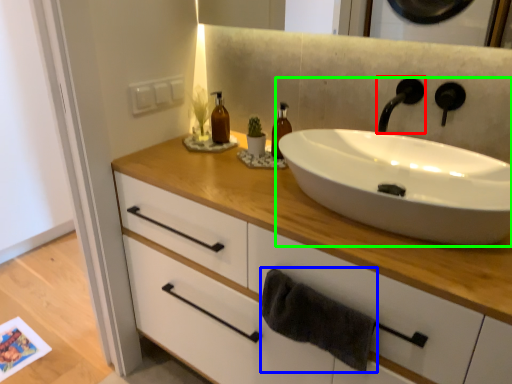
Question: Based on their relative distances, which object is farther from tap (highlighted by a red box)? Choose from bath towel (highlighted by a blue box) and sink (highlighted by a green box).

Choices:
 (A) bath towel
 (B) sink

Answer: (A)